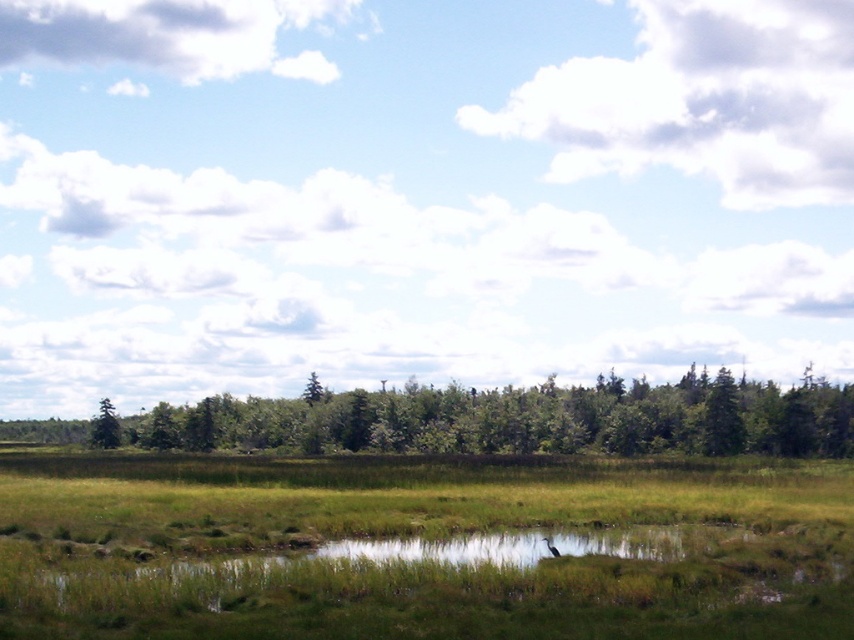
Question: Can you confirm if green leafy trees at center is positioned above green matte tree at left?

Choices:
 (A) yes
 (B) no

Answer: (A)

Question: Does green leafy trees at center come behind green matte tree at left?

Choices:
 (A) yes
 (B) no

Answer: (B)

Question: Does green leafy trees at center appear under green matte tree at left?

Choices:
 (A) no
 (B) yes

Answer: (A)

Question: Which of the following is the closest to the observer?

Choices:
 (A) green matte tree at left
 (B) green leafy trees at center

Answer: (B)